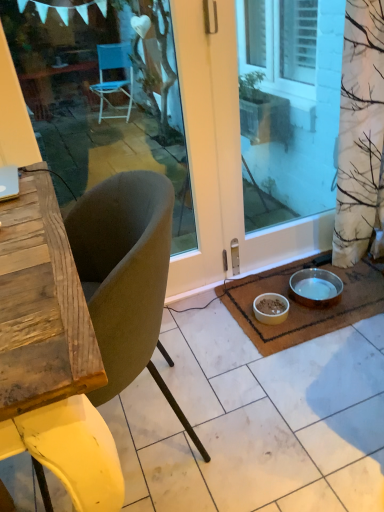
You are a GUI agent. You are given a task and a screenshot of the screen. Output one action in this format:
    pyautogui.click(x=<x>, y=<y>)
    Task: Click on the unoccupied region to the right of transparent glass door at center, the first window screen positioned from the right
    This screenshot has height=512, width=384.
    Given the screenshot: What is the action you would take?
    pyautogui.click(x=321, y=266)